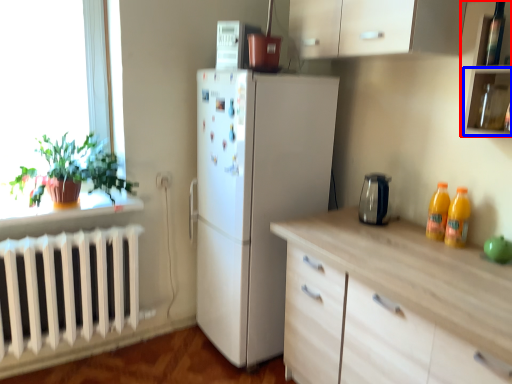
Question: Among these objects, which one is farthest to the camera, cabinetry (highlighted by a red box) or shelf (highlighted by a blue box)?

Choices:
 (A) cabinetry
 (B) shelf

Answer: (B)